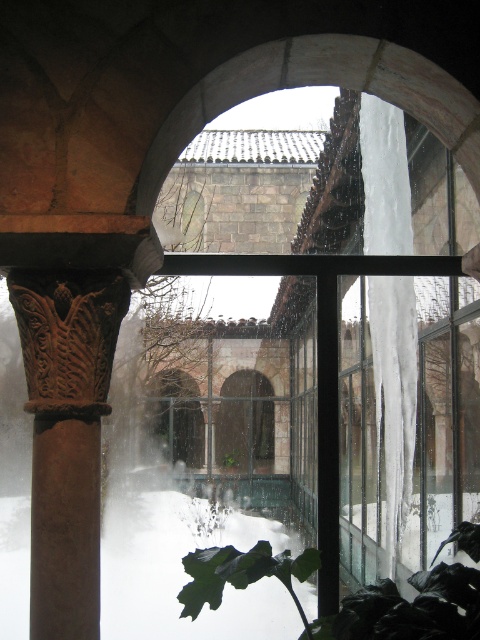
Question: Which object appears farthest from the camera in this image?

Choices:
 (A) green leafy plant at center
 (B) rusty metal column at left
 (C) white frosted glass at center

Answer: (C)

Question: Which is nearer to the green matte leaf at lower center?

Choices:
 (A) white frosted glass at center
 (B) green leafy plant at center

Answer: (B)

Question: Is green matte leaf at lower center bigger than green leafy plant at center?

Choices:
 (A) yes
 (B) no

Answer: (A)

Question: Can you confirm if rusty metal column at left is positioned below white frosted glass at center?

Choices:
 (A) no
 (B) yes

Answer: (A)

Question: From the image, what is the correct spatial relationship of rusty metal column at left in relation to white frosted glass at center?

Choices:
 (A) above
 (B) below

Answer: (A)

Question: Which object is farther from the camera taking this photo?

Choices:
 (A) rusty metal column at left
 (B) white frosted glass at center
 (C) green matte leaf at lower center
 (D) green leafy plant at center

Answer: (B)